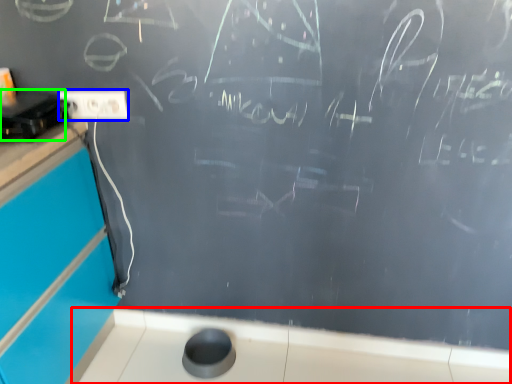
Question: Estimate the real-world distances between objects in this image. Which object is farther from counter top (highlighted by a red box), electric outlet (highlighted by a blue box) or appliance (highlighted by a green box)?

Choices:
 (A) electric outlet
 (B) appliance

Answer: (B)